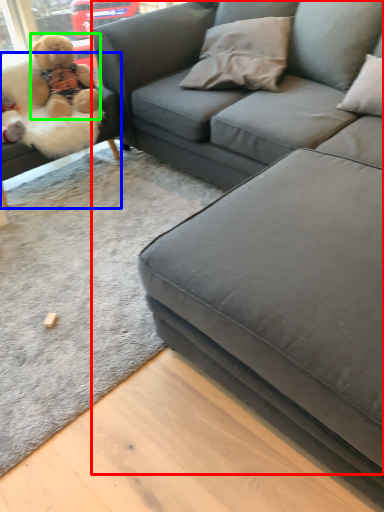
Question: Which object is the farthest from studio couch (highlighted by a red box)? Choose among these: studio couch (highlighted by a blue box) or teddy bear (highlighted by a green box).

Choices:
 (A) studio couch
 (B) teddy bear

Answer: (A)